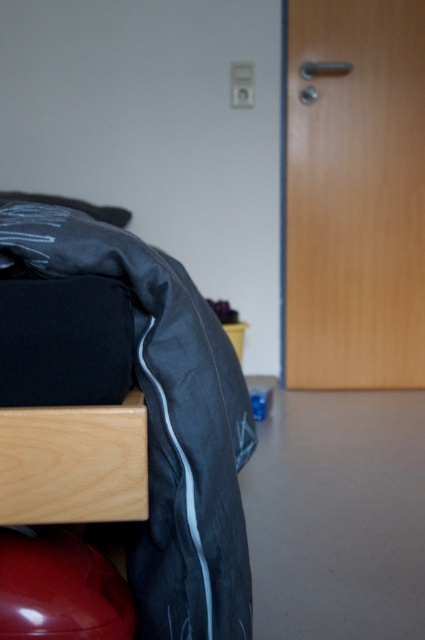
Question: Among these objects, which one is farthest from the camera?

Choices:
 (A) matte black bed at lower left
 (B) light wood drawer at lower left

Answer: (A)

Question: Is matte black bed at lower left below light wood drawer at lower left?

Choices:
 (A) no
 (B) yes

Answer: (A)

Question: Does matte black bed at lower left have a greater width compared to light wood drawer at lower left?

Choices:
 (A) yes
 (B) no

Answer: (A)

Question: Is matte black bed at lower left closer to the viewer compared to light wood drawer at lower left?

Choices:
 (A) no
 (B) yes

Answer: (A)